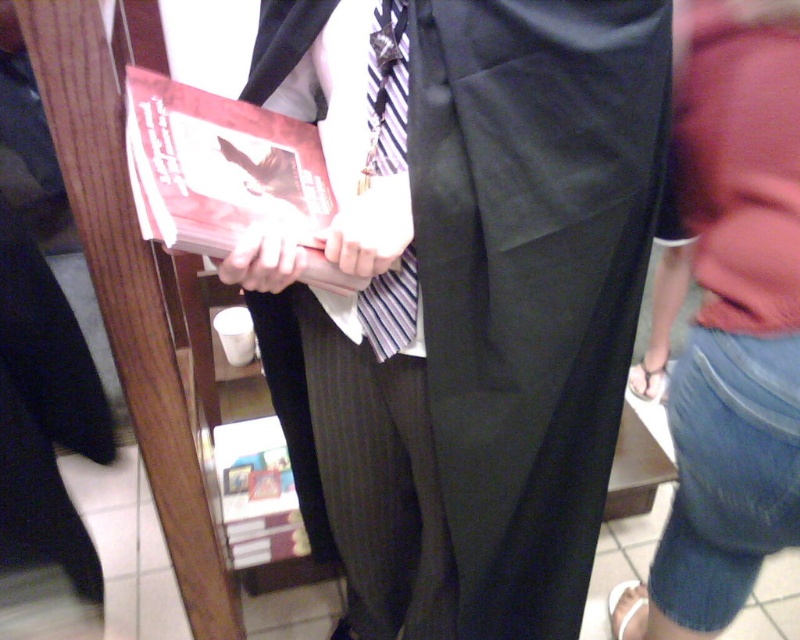
Looking at this image, you are a tailor measuring a customer for a suit. You have a tape measure and need to compare the width of the black satin pants at center and the matte white hand at center. Which one is wider?

The black satin pants at center is wider than the matte white hand at center according to the description.

You are standing in a bookstore and want to place a new item at point (732, 323). What item is currently located there?

The denim shorts at lower right are located at point (732, 323).

You are an interior designer assessing the layout of this bookstore. You notice the denim shorts at lower right and the matte black hand at center. Which object occupies more horizontal space in the image?

The denim shorts at lower right occupies more horizontal space than the matte black hand at center because its width is larger.